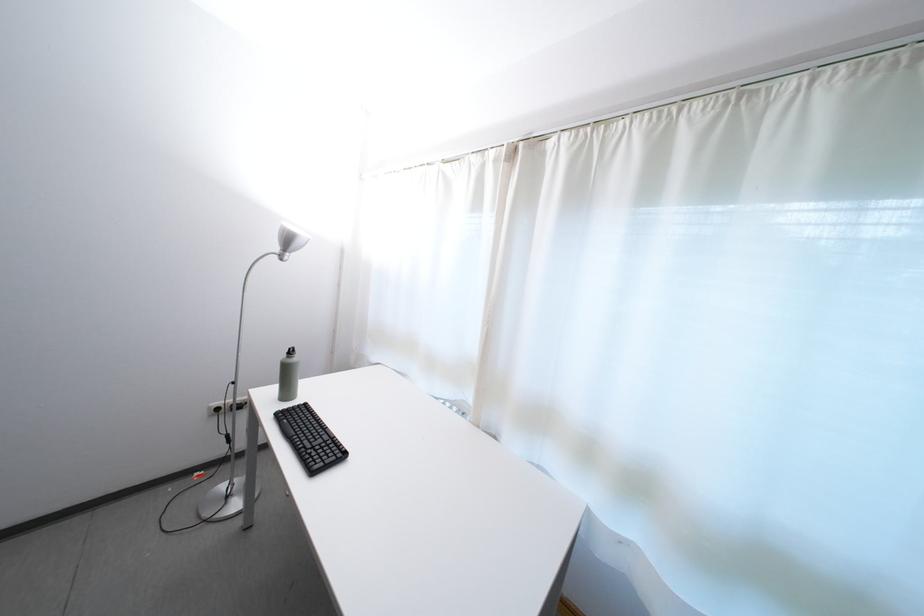
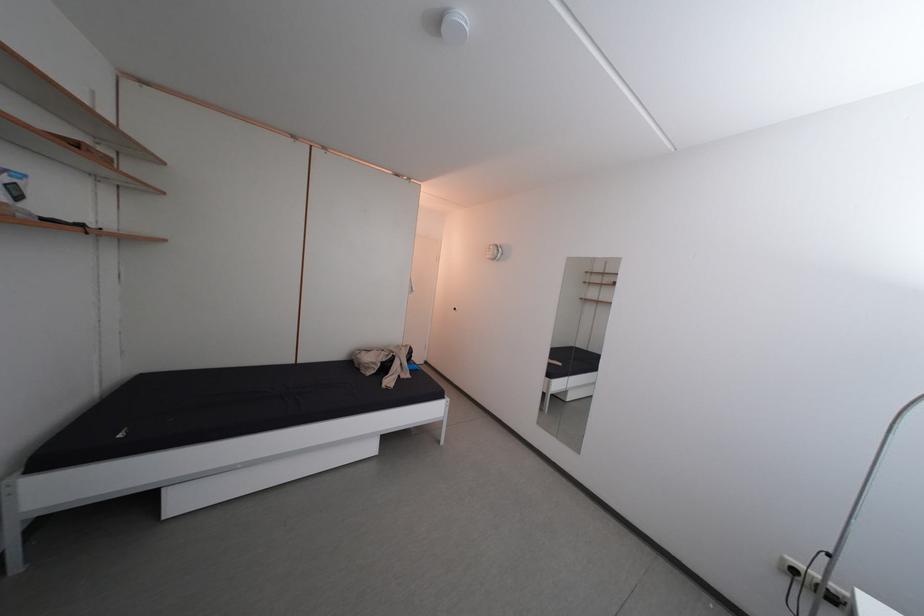
Question: The images are taken continuously from a first-person perspective. In which direction is your viewpoint rotating?

Choices:
 (A) Left
 (B) Right
 (C) Up
 (D) Down

Answer: (A)